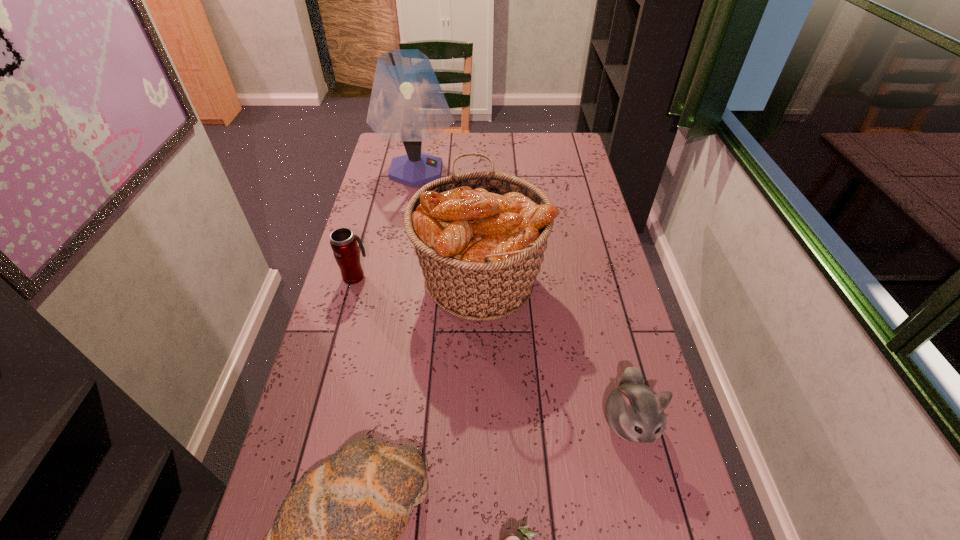
Where is `vacant space located on the face of the hamster`? vacant space located on the face of the hamster is located at coordinates (645, 487).

I want to click on object that is at the far edge, so click(x=407, y=104).

The width and height of the screenshot is (960, 540). I want to click on lampshade at the left edge, so click(407, 104).

What are the coordinates of `thermos bottle situated at the left edge` in the screenshot? It's located at (343, 242).

Locate an element on the screen. object present at the right edge is located at coordinates (634, 412).

The image size is (960, 540). I want to click on object that is at the far left corner, so click(407, 104).

I want to click on blank space at the far edge of the desktop, so click(x=445, y=154).

Where is `free point at the left edge`? This screenshot has width=960, height=540. free point at the left edge is located at coordinates (383, 228).

Where is `vacant position at the right edge of the desktop`? vacant position at the right edge of the desktop is located at coordinates (609, 360).

Where is `blank space at the far left corner of the desktop`? The image size is (960, 540). blank space at the far left corner of the desktop is located at coordinates click(385, 152).